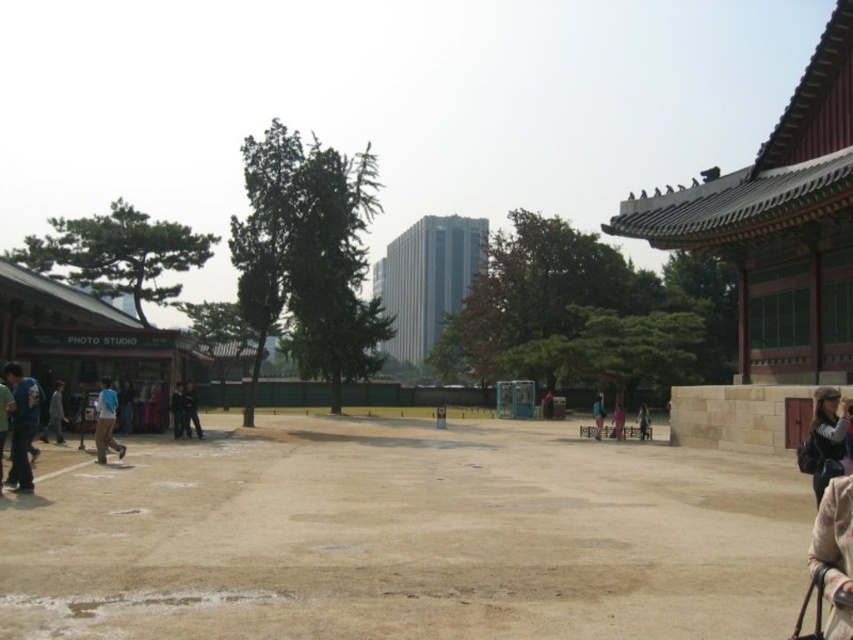
Can you confirm if smooth glass skyscraper at center is positioned below blue cotton shirt at lower left?

Incorrect, smooth glass skyscraper at center is not positioned below blue cotton shirt at lower left.

What are the coordinates of `smooth glass skyscraper at center` in the screenshot? It's located at coord(427,280).

The width and height of the screenshot is (853, 640). I want to click on smooth glass skyscraper at center, so click(x=427, y=280).

Looking at this image, is dark brown leather jacket at lower right positioned behind dark blue fabric at center?

That is False.

Does point (820, 483) lie in front of point (183, 435)?

Yes.

The height and width of the screenshot is (640, 853). What are the coordinates of `dark brown leather jacket at lower right` in the screenshot? It's located at (827, 440).

I want to click on dark brown leather jacket at lower right, so click(827, 440).

Is point (22, 435) farther from camera compared to point (55, 413)?

No.

Does blue fabric jacket at lower left have a lesser height compared to gray fabric jacket at lower left?

No.

Where is `blue fabric jacket at lower left`? The width and height of the screenshot is (853, 640). blue fabric jacket at lower left is located at coordinates (22, 426).

Find the location of `blue fabric jacket at lower left`. blue fabric jacket at lower left is located at coordinates (22, 426).